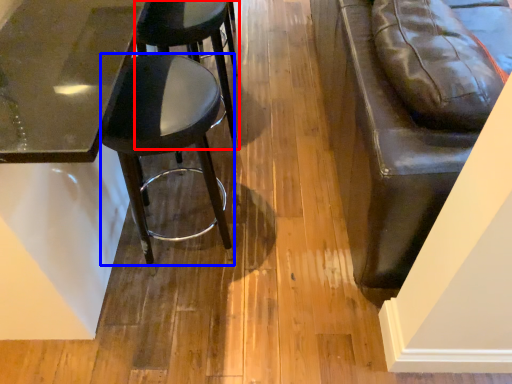
Question: Among these objects, which one is farthest to the camera, stool (highlighted by a red box) or stool (highlighted by a blue box)?

Choices:
 (A) stool
 (B) stool

Answer: (A)